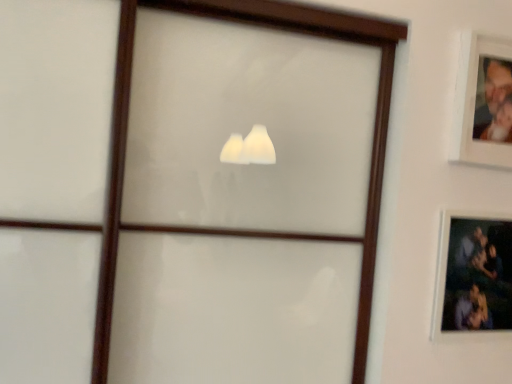
Question: Is white matte picture frame at upper right, which is the 1th picture frame from top to bottom, in front of or behind matte black picture frame at upper right, the second picture frame from the top, in the image?

Choices:
 (A) behind
 (B) front

Answer: (B)

Question: From the image's perspective, is white matte picture frame at upper right, marked as the second picture frame in a bottom-to-top arrangement, above or below matte black picture frame at upper right, the second picture frame from the top?

Choices:
 (A) below
 (B) above

Answer: (B)

Question: In terms of size, does white matte picture frame at upper right, marked as the second picture frame in a bottom-to-top arrangement, appear bigger or smaller than matte black picture frame at upper right, which ranks as the first picture frame in bottom-to-top order?

Choices:
 (A) small
 (B) big

Answer: (A)

Question: Is matte black picture frame at upper right, the second picture frame from the top, bigger or smaller than white matte picture frame at upper right, marked as the second picture frame in a bottom-to-top arrangement?

Choices:
 (A) big
 (B) small

Answer: (A)

Question: From the image's perspective, is matte black picture frame at upper right, the second picture frame from the top, above or below white matte picture frame at upper right, which is the 1th picture frame from top to bottom?

Choices:
 (A) above
 (B) below

Answer: (B)

Question: Is matte black picture frame at upper right, the second picture frame from the top, to the left or to the right of white matte picture frame at upper right, marked as the second picture frame in a bottom-to-top arrangement, in the image?

Choices:
 (A) right
 (B) left

Answer: (B)

Question: Considering the positions of point tap(492, 226) and point tap(486, 148), is point tap(492, 226) closer or farther from the camera than point tap(486, 148)?

Choices:
 (A) closer
 (B) farther

Answer: (B)